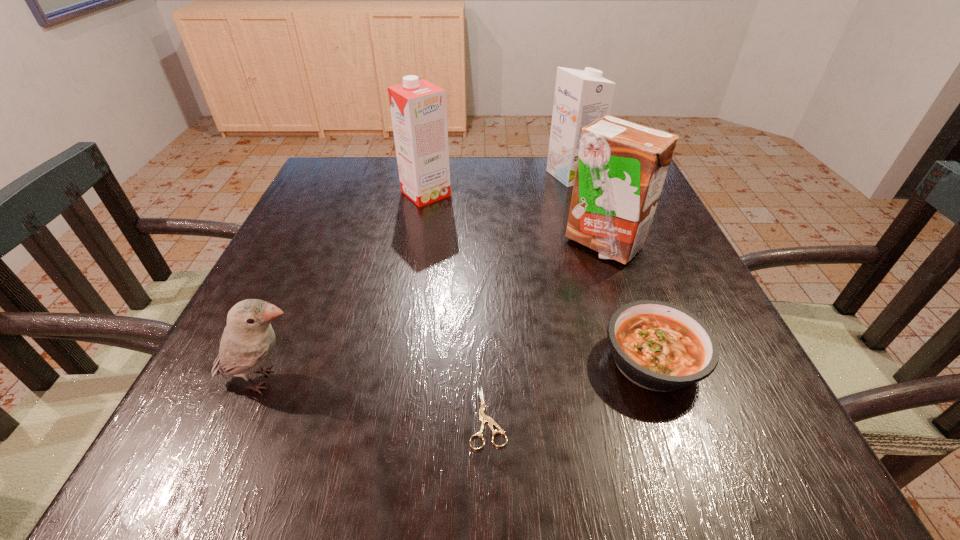
You are a GUI agent. You are given a task and a screenshot of the screen. Output one action in this format:
    pyautogui.click(x=<x>, y=<y>)
    Task: Click on the free location at the far left corner
    
    Given the screenshot: What is the action you would take?
    pyautogui.click(x=341, y=194)

Where is `vacant area at the near left corner`? vacant area at the near left corner is located at coordinates (208, 435).

Where is `free space at the near right corner`? free space at the near right corner is located at coordinates (807, 479).

Identify the location of vacant area that lies between the leftmost object and the nearest carton. The width and height of the screenshot is (960, 540). (434, 312).

This screenshot has width=960, height=540. Identify the location of free space between the leftmost object and the nearest carton. (434, 312).

The height and width of the screenshot is (540, 960). In order to click on free space between the second shortest object and the fourth tallest object in this screenshot , I will do `click(459, 370)`.

What are the coordinates of `empty space that is in between the fourth nearest object and the stew` in the screenshot? It's located at (628, 302).

What are the coordinates of `free space between the fifth tallest object and the fourth tallest object` in the screenshot? It's located at (459, 370).

This screenshot has height=540, width=960. Identify the location of vacant point located between the bird and the fourth nearest object. (434, 312).

Image resolution: width=960 pixels, height=540 pixels. Identify the location of vacant space in between the shortest object and the nearest carton. (545, 330).